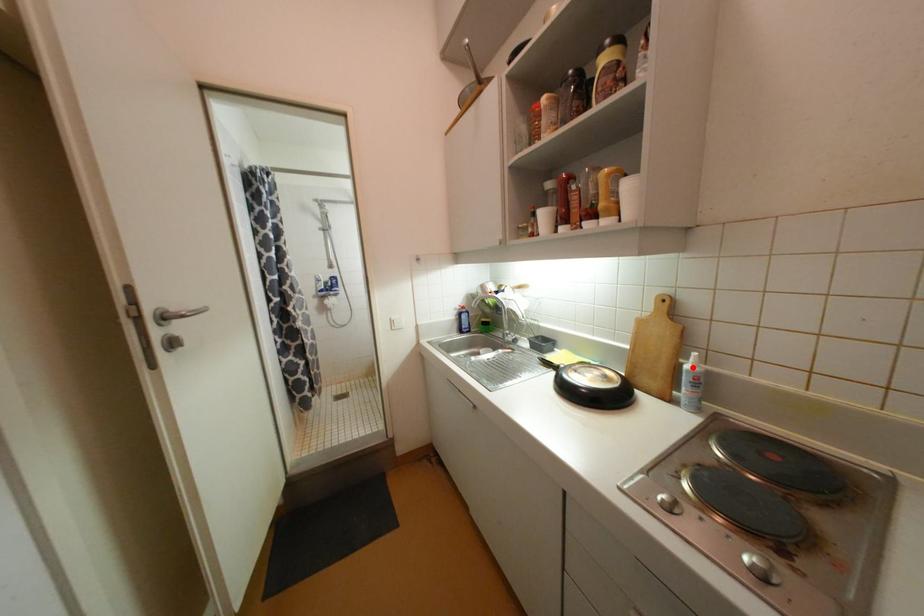
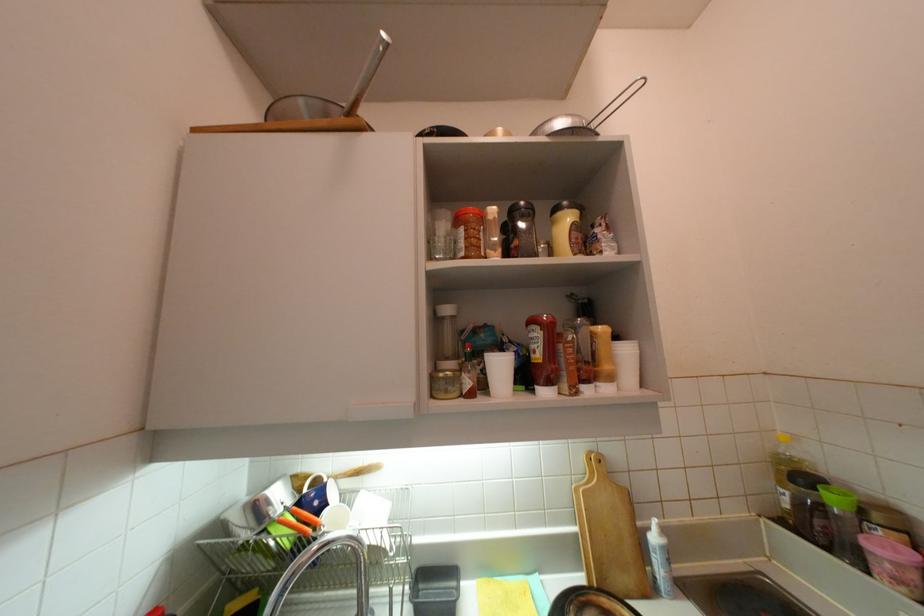
In the second image, find the point that corresponds to the highlighted location in the first image.

(660, 540)